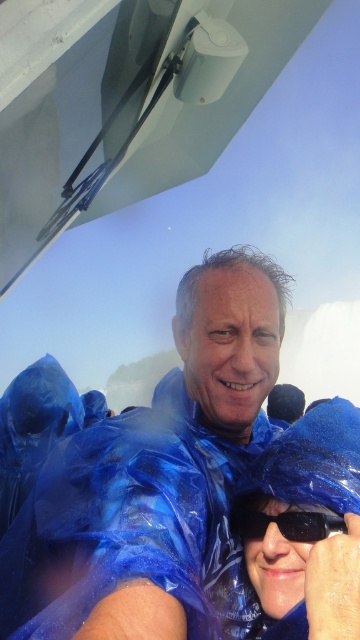
Question: Which of the following is the closest to the observer?

Choices:
 (A) (240, 518)
 (B) (29, 605)

Answer: (B)

Question: Which object is closer to the camera taking this photo?

Choices:
 (A) black plastic goggles at center
 (B) blue plastic poncho at center

Answer: (B)

Question: Is blue plastic poncho at center to the left of black plastic goggles at center from the viewer's perspective?

Choices:
 (A) no
 (B) yes

Answer: (B)

Question: Can you confirm if blue plastic poncho at center is positioned above black plastic goggles at center?

Choices:
 (A) yes
 (B) no

Answer: (A)

Question: Does blue plastic poncho at center appear on the right side of black plastic goggles at center?

Choices:
 (A) no
 (B) yes

Answer: (A)